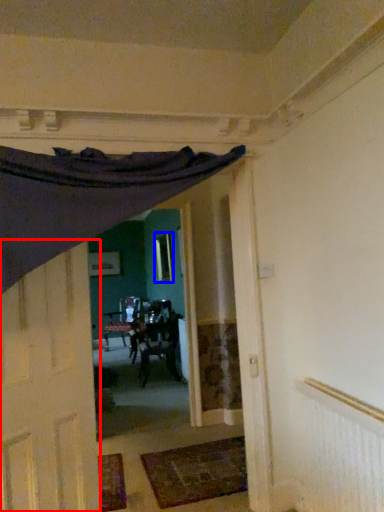
Question: Which object appears closest to the camera in this image, door (highlighted by a red box) or window (highlighted by a blue box)?

Choices:
 (A) door
 (B) window

Answer: (A)